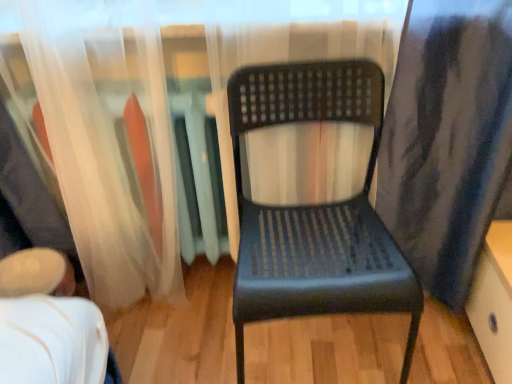
Locate an element on the screen. free space to the left of matte black chair at center is located at coordinates (180, 340).